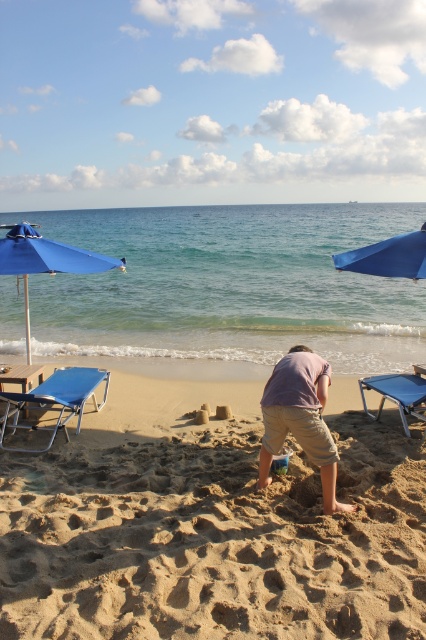
Find the location of a particular element. The height and width of the screenshot is (640, 426). blue fabric umbrella at upper center is located at coordinates (388, 257).

Can you confirm if blue fabric umbrella at upper center is taller than blue fabric umbrella at right?

Yes, blue fabric umbrella at upper center is taller than blue fabric umbrella at right.

Find the location of a particular element. blue fabric umbrella at upper center is located at coordinates (388, 257).

Between fine-grained sand at center and blue fabric umbrella at upper center, which one appears on the right side from the viewer's perspective?

Positioned to the right is blue fabric umbrella at upper center.

Is fine-grained sand at center closer to the viewer compared to blue fabric umbrella at upper center?

That is True.

Between point (126, 378) and point (365, 256), which one is positioned behind?

Point (126, 378)

You are a GUI agent. You are given a task and a screenshot of the screen. Output one action in this format:
    pyautogui.click(x=<x>, y=<y>)
    Task: Click on the fine-grained sand at center
    This screenshot has height=640, width=426.
    Given the screenshot: What is the action you would take?
    pyautogui.click(x=212, y=525)

Which is in front, point (31, 474) or point (299, 410)?

Point (299, 410)

From the picture: Can you confirm if fine-grained sand at center is shorter than pink cotton shirt at center?

Correct, fine-grained sand at center is not as tall as pink cotton shirt at center.

Identify the location of fine-grained sand at center. (212, 525).